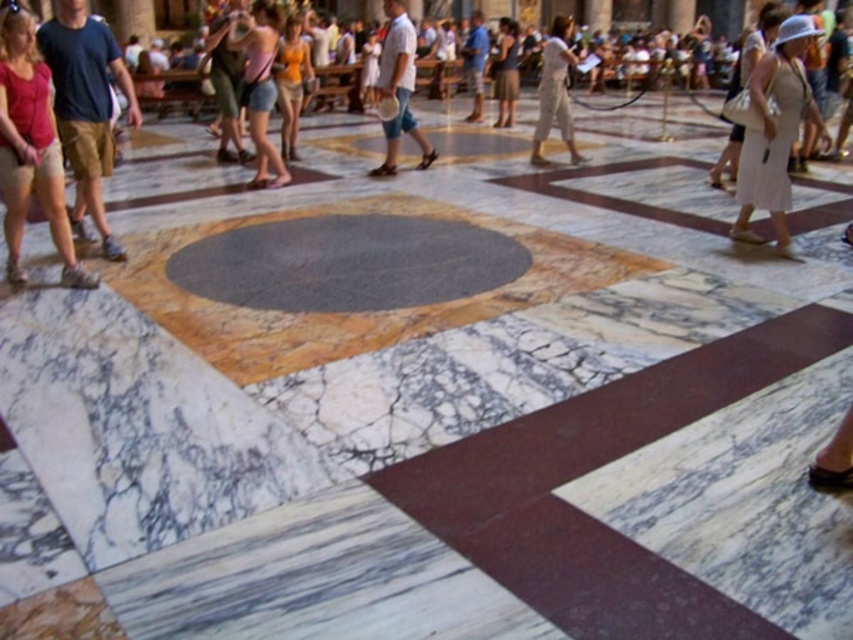
You are a photographer trying to capture a candid shot of the person wearing the matte pink shorts at center and the white cotton shirt at center. Since you want both subjects to be in focus, you need to know which one is wider. Which clothing item is wider?

The matte pink shorts at center might be wider than white cotton shirt at center.

You are a photographer trying to capture both the white cotton shirt at center and the dark brown leather jacket at center in the same frame. Since they are both at the center, which one will appear bigger in your photo?

The white cotton shirt at center will appear bigger in the photo because it is larger in size than the dark brown leather jacket at center.